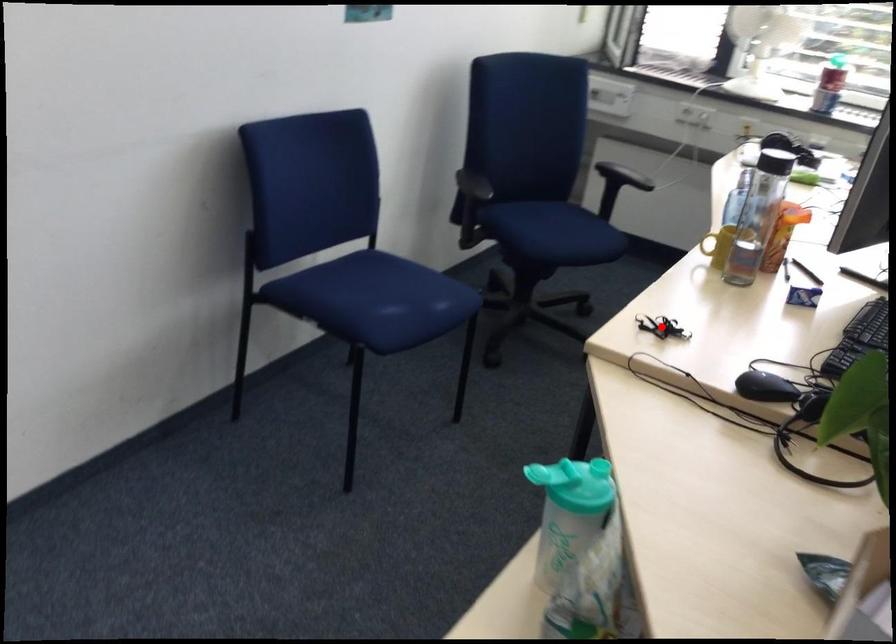
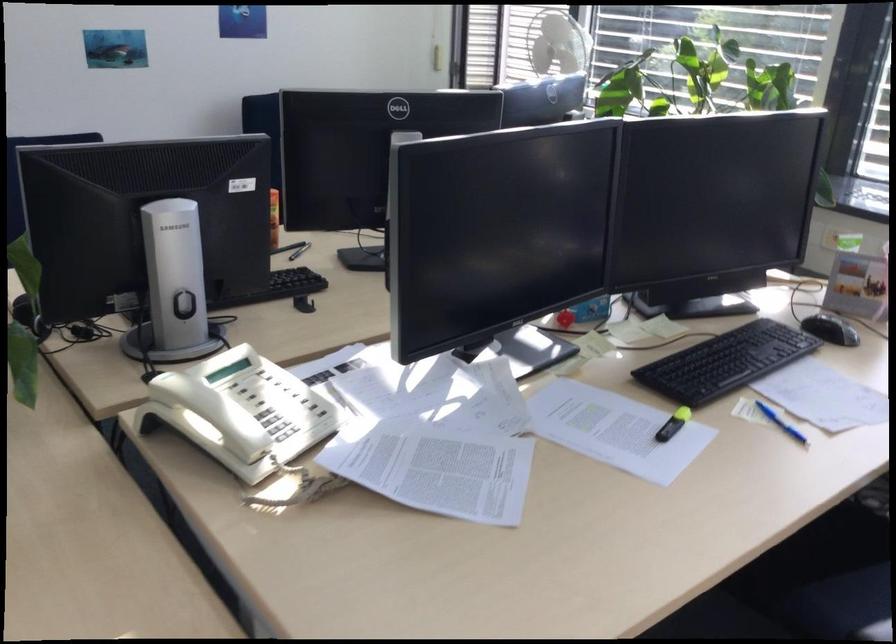
Question: I am providing you with two images of the same scene from different viewpoints. A red point is marked on the first image. At the location where the point appears in image 1, is it still visible in image 2?

Choices:
 (A) Yes
 (B) No

Answer: (B)